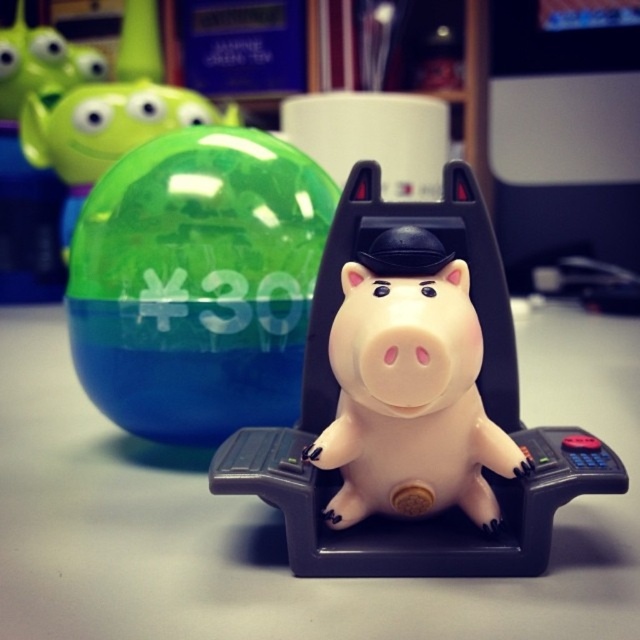
You are a child who wants to place the transparent plastic ball at upper left and the rubber piggy bank at center into a box that can only hold items narrower than the piggy bank. Which item should you choose?

The transparent plastic ball at upper left has a width less than the rubber piggy bank at center, so you should choose the transparent plastic ball at upper left to place into the box.

Looking at this image, you have two piggy banks in front of you, a rubber piggy bank at center and a satin pink piggy bank at center. Which one is taller?

The rubber piggy bank at center is taller than the satin pink piggy bank at center.